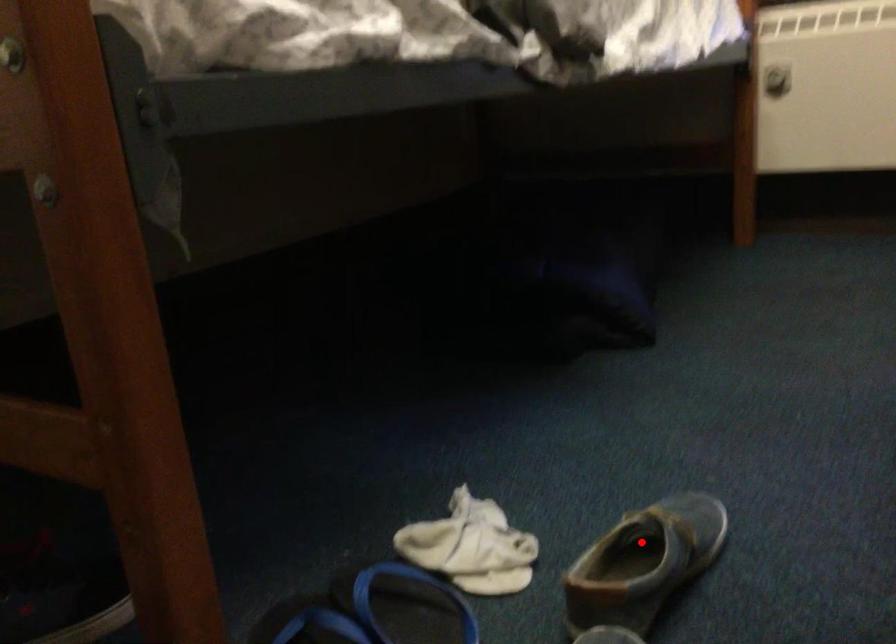
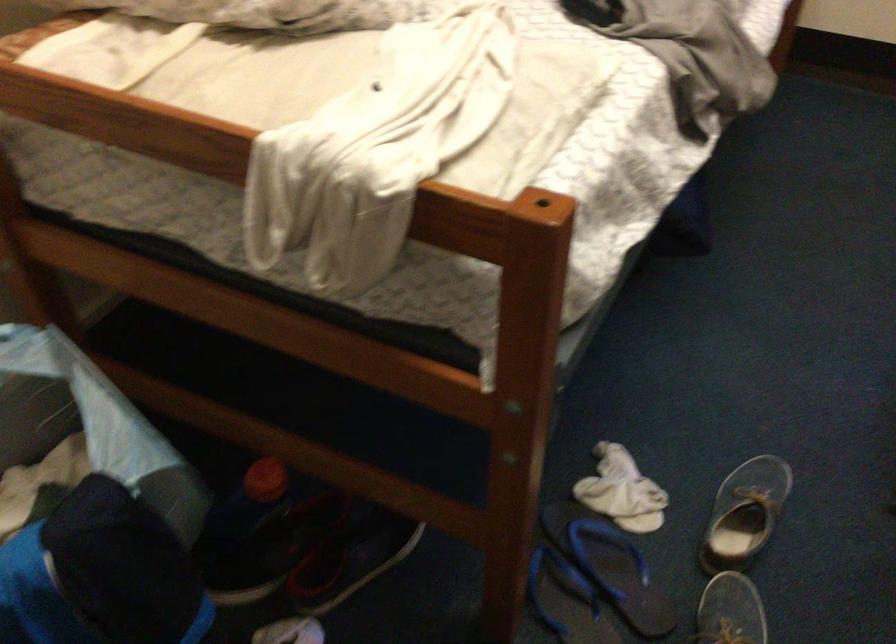
Question: I am providing you with two images of the same scene from different viewpoints. A red point is marked on the first image. Is the red point's position out of view in image 2?

Choices:
 (A) Yes
 (B) No

Answer: (B)